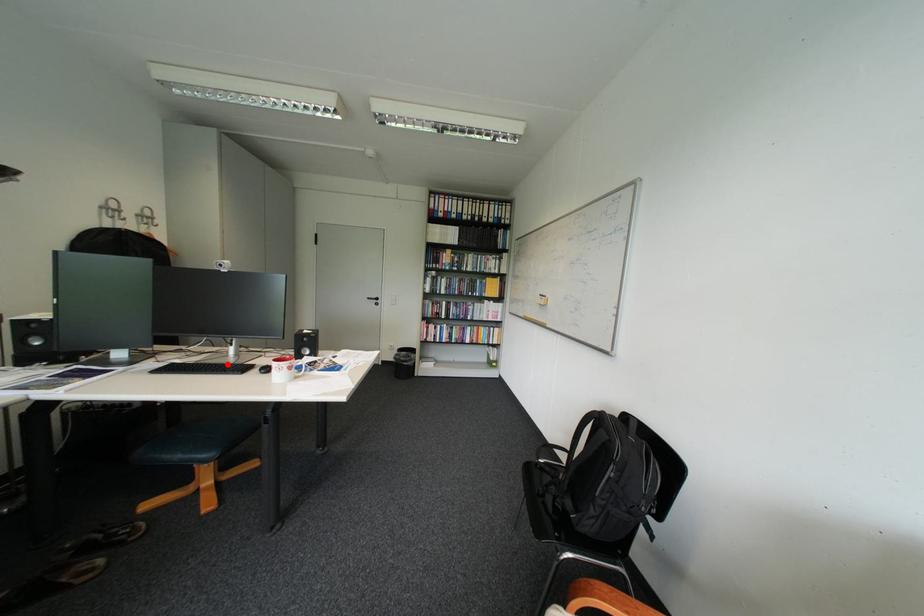
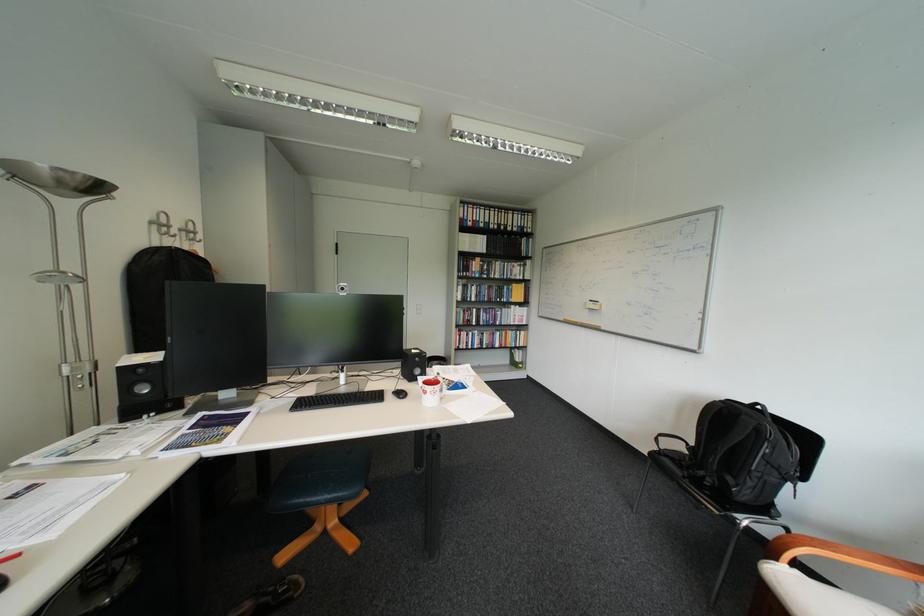
Find the pixel in the second image that matches the highlighted location in the first image.

(357, 394)